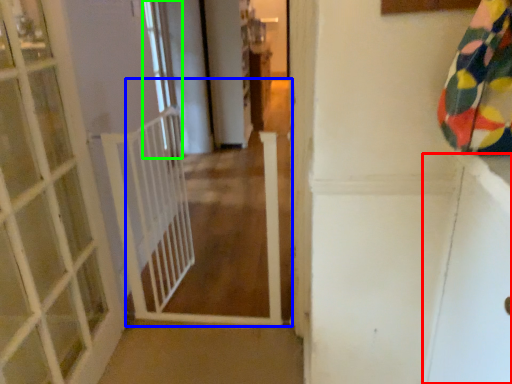
Question: Considering the real-world distances, which object is farthest from screen door (highlighted by a red box)? path (highlighted by a blue box) or window (highlighted by a green box)?

Choices:
 (A) path
 (B) window

Answer: (B)